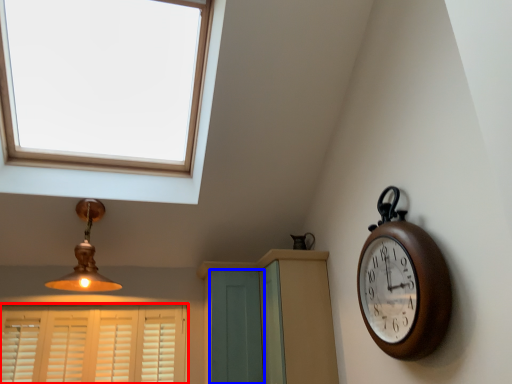
Question: Among these objects, which one is farthest to the camera, window (highlighted by a red box) or screen door (highlighted by a blue box)?

Choices:
 (A) window
 (B) screen door

Answer: (A)